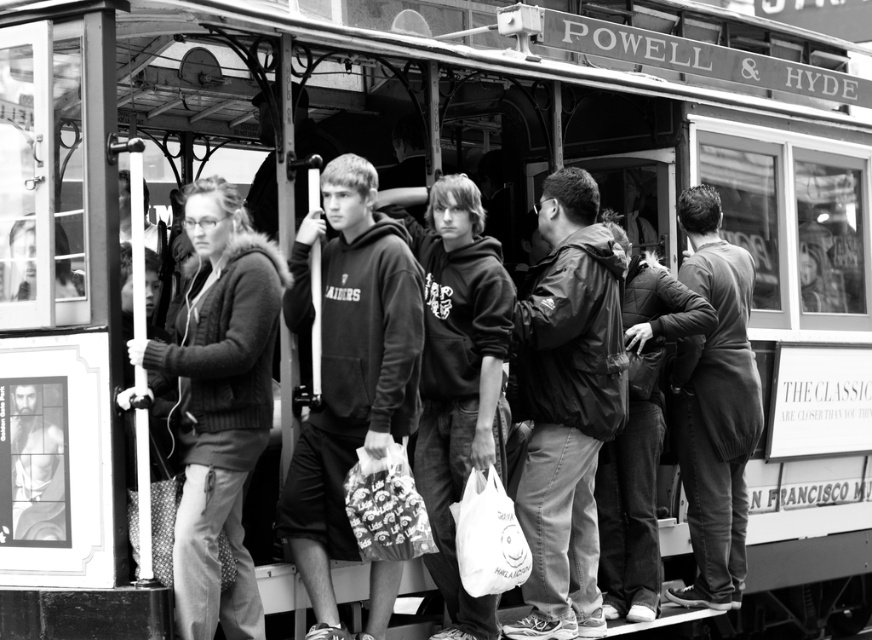
Which of these two, matte black hoodie at center or dark gray quilted jacket at center, stands taller?

Standing taller between the two is matte black hoodie at center.

Is matte black hoodie at center thinner than dark gray quilted jacket at center?

Yes.

Identify the location of matte black hoodie at center. This screenshot has width=872, height=640. click(460, 380).

Identify the location of matte black hoodie at center. (460, 380).

Is knitted sweater at center bigger than dark gray quilted jacket at center?

Yes, knitted sweater at center is bigger than dark gray quilted jacket at center.

Who is more forward, [154,385] or [610,486]?

Point [154,385]

Identify the location of knitted sweater at center. (218, 403).

Does dark gray hoodie at center lie behind dark gray quilted jacket at center?

No, dark gray hoodie at center is closer to the viewer.

Is dark gray hoodie at center to the right of dark gray quilted jacket at center from the viewer's perspective?

In fact, dark gray hoodie at center is to the left of dark gray quilted jacket at center.

Find the location of `dark gray hoodie at center`. dark gray hoodie at center is located at coordinates (348, 369).

Find the location of a particular element. dark gray hoodie at center is located at coordinates (348, 369).